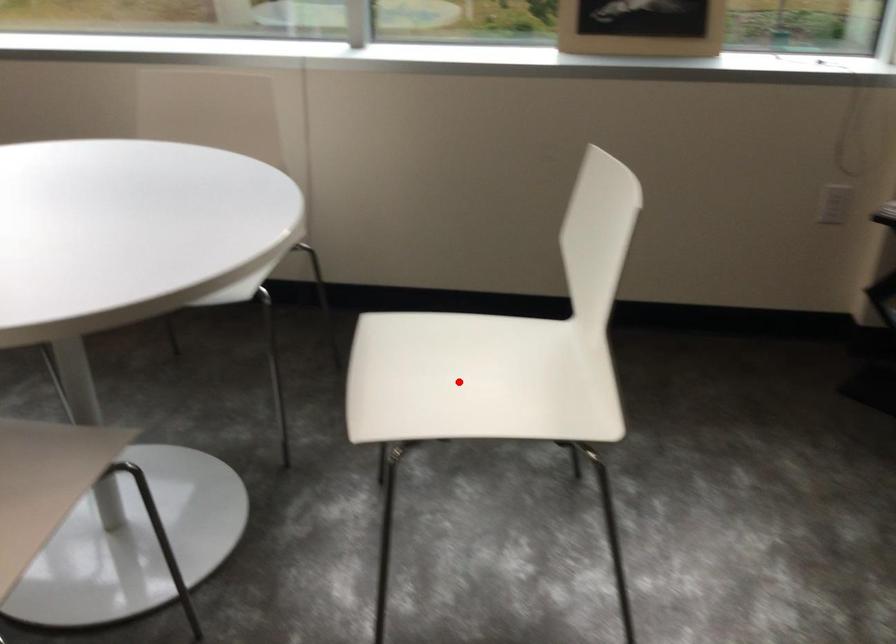
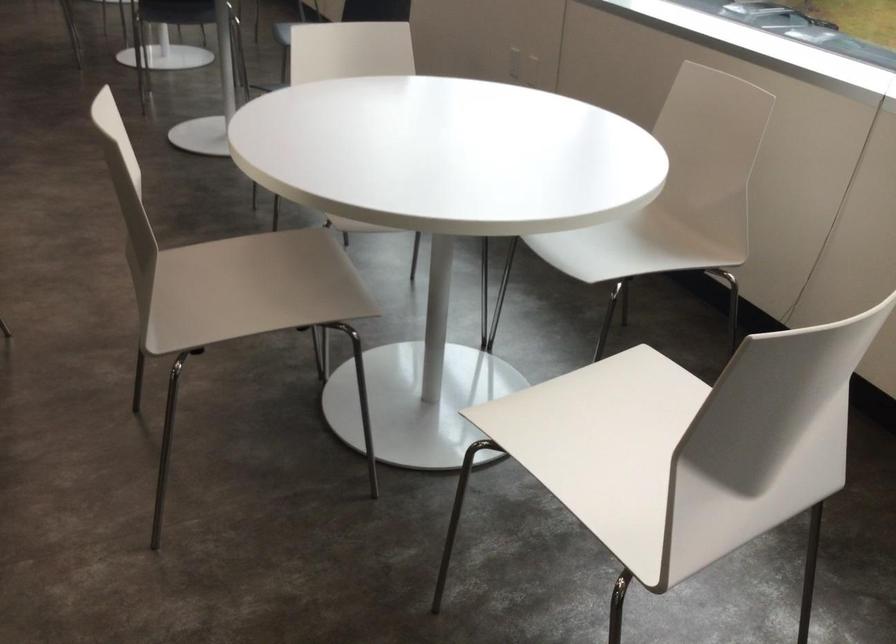
Question: I am providing you with two images of the same scene from different viewpoints. Given a red point in image1, look at the same physical point in image2. Is it:

Choices:
 (A) Closer to the viewpoint
 (B) Farther from the viewpoint

Answer: (A)